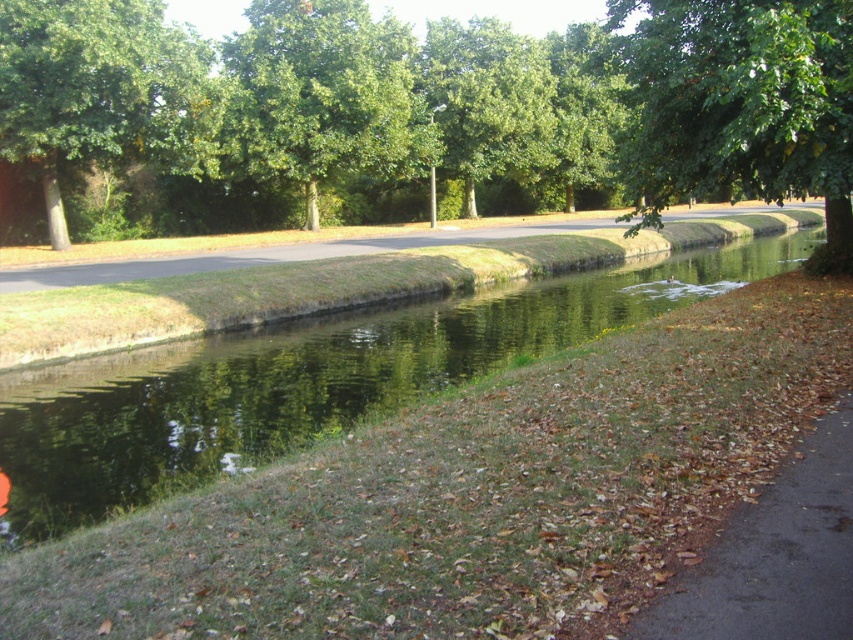
Who is taller, green leafy tree at upper center or brown asphalt pavement at lower right?

Standing taller between the two is green leafy tree at upper center.

Can you confirm if green leafy tree at upper center is positioned to the left of brown asphalt pavement at lower right?

Yes, green leafy tree at upper center is to the left of brown asphalt pavement at lower right.

Where is `green leafy tree at upper center`? green leafy tree at upper center is located at coordinates (322, 93).

Does green leafy tree at center have a greater width compared to green leafy tree at upper right?

Yes, green leafy tree at center is wider than green leafy tree at upper right.

Between green leafy tree at center and green leafy tree at upper right, which one is positioned lower?

Positioned lower is green leafy tree at upper right.

What do you see at coordinates (422, 112) in the screenshot?
I see `green leafy tree at center` at bounding box center [422, 112].

Locate an element on the screen. green leafy tree at center is located at coordinates (422, 112).

Who is shorter, brown asphalt pavement at lower right or green grass at center?

brown asphalt pavement at lower right

Does brown asphalt pavement at lower right lie in front of green grass at center?

Yes, brown asphalt pavement at lower right is in front of green grass at center.

Where is `brown asphalt pavement at lower right`? Image resolution: width=853 pixels, height=640 pixels. brown asphalt pavement at lower right is located at coordinates (773, 556).